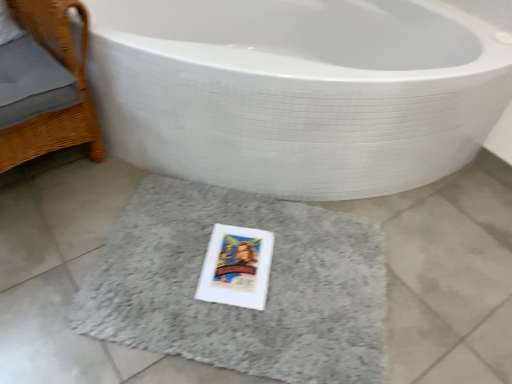
Question: Could gray shaggy bath mat at center be considered to be inside woven wood chair at left?

Choices:
 (A) yes
 (B) no

Answer: (B)

Question: Can you confirm if woven wood chair at left is positioned to the left of gray shaggy bath mat at center?

Choices:
 (A) yes
 (B) no

Answer: (A)

Question: From a real-world perspective, does woven wood chair at left sit lower than gray shaggy bath mat at center?

Choices:
 (A) no
 (B) yes

Answer: (A)

Question: From the image's perspective, does woven wood chair at left appear lower than gray shaggy bath mat at center?

Choices:
 (A) no
 (B) yes

Answer: (A)

Question: Is woven wood chair at left closer to the viewer compared to gray shaggy bath mat at center?

Choices:
 (A) no
 (B) yes

Answer: (B)

Question: From a real-world perspective, relative to white glossy bathtub at center, is gray shaggy bath mat at center vertically above or below?

Choices:
 (A) below
 (B) above

Answer: (A)

Question: From the image's perspective, is gray shaggy bath mat at center located above or below white glossy bathtub at center?

Choices:
 (A) above
 (B) below

Answer: (B)

Question: Choose the correct answer: Is gray shaggy bath mat at center inside white glossy bathtub at center or outside it?

Choices:
 (A) outside
 (B) inside

Answer: (B)

Question: Is point (279, 274) positioned closer to the camera than point (249, 152)?

Choices:
 (A) farther
 (B) closer

Answer: (B)

Question: Is point (357, 337) closer or farther from the camera than point (67, 135)?

Choices:
 (A) farther
 (B) closer

Answer: (B)

Question: Is gray shaggy bath mat at center taller or shorter than woven wood chair at left?

Choices:
 (A) tall
 (B) short

Answer: (B)

Question: Based on their sizes in the image, would you say gray shaggy bath mat at center is bigger or smaller than woven wood chair at left?

Choices:
 (A) big
 (B) small

Answer: (B)

Question: From the image's perspective, is gray shaggy bath mat at center above or below woven wood chair at left?

Choices:
 (A) above
 (B) below

Answer: (B)

Question: Considering the relative positions of woven wood chair at left and white glossy bathtub at center in the image provided, is woven wood chair at left to the left or to the right of white glossy bathtub at center?

Choices:
 (A) right
 (B) left

Answer: (B)

Question: In terms of size, does woven wood chair at left appear bigger or smaller than white glossy bathtub at center?

Choices:
 (A) small
 (B) big

Answer: (A)